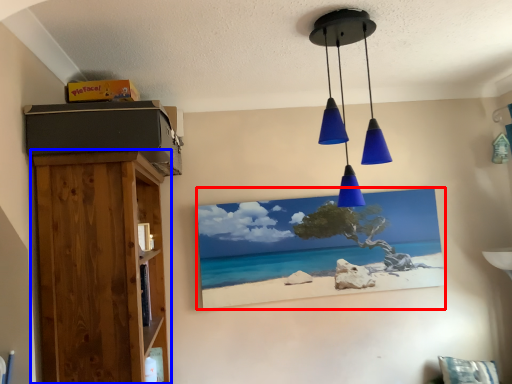
Question: Which object is further to the camera taking this photo, picture frame (highlighted by a red box) or furniture (highlighted by a blue box)?

Choices:
 (A) picture frame
 (B) furniture

Answer: (A)